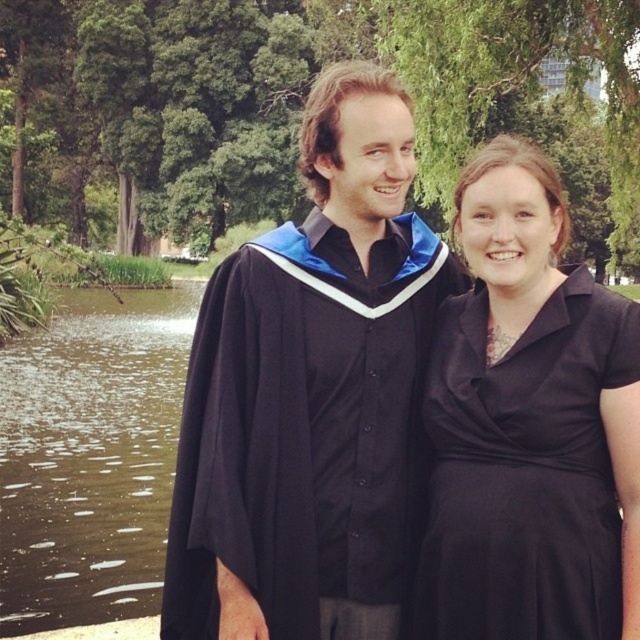
Question: Among these objects, which one is farthest from the camera?

Choices:
 (A) black matte graduation gown at center
 (B) black satin dress at center

Answer: (A)

Question: Is black matte graduation gown at center in front of black satin dress at center?

Choices:
 (A) no
 (B) yes

Answer: (A)

Question: Does black matte graduation gown at center have a smaller size compared to black satin dress at center?

Choices:
 (A) no
 (B) yes

Answer: (A)

Question: Does black matte graduation gown at center have a smaller size compared to black satin dress at center?

Choices:
 (A) no
 (B) yes

Answer: (A)